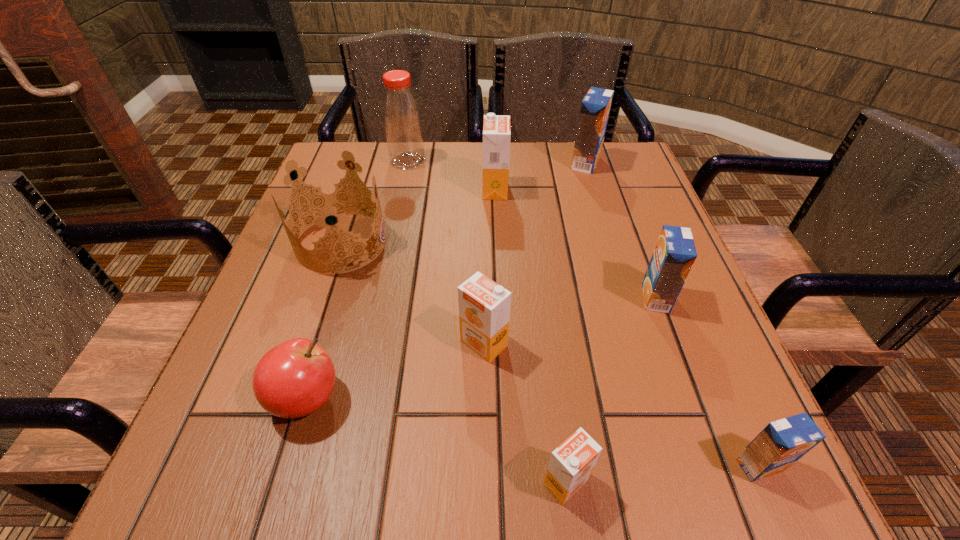
Locate an element on the screen. The height and width of the screenshot is (540, 960). vacant region at the far edge of the desktop is located at coordinates (x=520, y=159).

Identify the location of free space at the right edge of the desktop. (657, 342).

The image size is (960, 540). What are the coordinates of `vacant space at the near left corner of the desktop` in the screenshot? It's located at (259, 487).

Locate an element on the screen. This screenshot has height=540, width=960. free space between the second smallest orange orange juice and the third farthest orange juice is located at coordinates (570, 320).

I want to click on vacant region between the farthest orange orange juice and the nearest blue orange_juice, so click(627, 327).

In order to click on free space between the sixth farthest object and the nearest blue orange_juice in this screenshot , I will do `click(621, 404)`.

Locate an element on the screen. The width and height of the screenshot is (960, 540). free point between the second farthest blue orange_juice and the farthest orange orange juice is located at coordinates (575, 244).

Identify the location of vacant area that lies between the farthest orange juice and the second biggest blue orange_juice. (621, 230).

Locate an element on the screen. Image resolution: width=960 pixels, height=540 pixels. empty location between the farthest orange juice and the second nearest orange orange juice is located at coordinates (535, 253).

In order to click on free spot between the red bottle and the fourth farthest orange juice in this screenshot , I will do `click(445, 252)`.